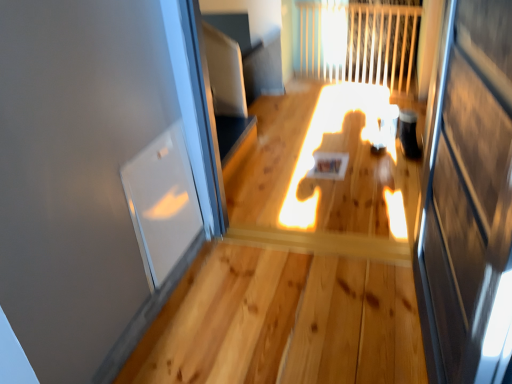
Describe the element at coordinates (468, 199) in the screenshot. I see `transparent glass screen door at right` at that location.

Locate an element on the screen. The image size is (512, 384). transparent glass screen door at right is located at coordinates (468, 199).

What do you see at coordinates (162, 203) in the screenshot? The image size is (512, 384). I see `transparent glass window at left` at bounding box center [162, 203].

You are a GUI agent. You are given a task and a screenshot of the screen. Output one action in this format:
    pyautogui.click(x=<x>, y=<y>)
    Task: Click on the transparent glass window at left
    
    Given the screenshot: What is the action you would take?
    pyautogui.click(x=162, y=203)

At what (x,y) coordinates should I click in order to perform the action: click on transparent glass screen door at right. Please return your answer as a coordinate pair (x, y). Looking at the image, I should click on (468, 199).

Considering the relative positions of transparent glass window at left and transparent glass screen door at right in the image provided, is transparent glass window at left to the right of transparent glass screen door at right from the viewer's perspective?

No, transparent glass window at left is not to the right of transparent glass screen door at right.

Which object is further away from the camera, transparent glass window at left or transparent glass screen door at right?

transparent glass window at left is more distant.

Which point is more distant from viewer, (187, 230) or (475, 294)?

The point (187, 230) is more distant.

From the image's perspective, between transparent glass window at left and transparent glass screen door at right, who is located below?

transparent glass screen door at right, from the image's perspective.

From a real-world perspective, which object rests below the other?

transparent glass window at left is physically lower.

Which object is thinner, transparent glass window at left or transparent glass screen door at right?

With smaller width is transparent glass window at left.

Based on the photo, between transparent glass window at left and transparent glass screen door at right, which one has more height?

transparent glass screen door at right.

Considering the relative sizes of transparent glass window at left and transparent glass screen door at right in the image provided, is transparent glass window at left bigger than transparent glass screen door at right?

No.

Is transparent glass screen door at right completely or partially inside transparent glass window at left?

No, transparent glass screen door at right is located outside of transparent glass window at left.

Is transparent glass window at left far from transparent glass screen door at right?

No, transparent glass window at left is in close proximity to transparent glass screen door at right.

Is transparent glass window at left facing towards transparent glass screen door at right?

Yes.

How different are the orientations of transparent glass window at left and transparent glass screen door at right in degrees?

The angular difference between transparent glass window at left and transparent glass screen door at right is 178 degrees.

Identify the location of screen door that is above the transparent glass window at left (from a real-world perspective). (468, 199).

Considering the positions of objects transparent glass screen door at right and transparent glass window at left in the image provided, who is more to the right, transparent glass screen door at right or transparent glass window at left?

transparent glass screen door at right.

Is transparent glass screen door at right closer to camera compared to transparent glass window at left?

Yes, the depth of transparent glass screen door at right is less than that of transparent glass window at left.

Does point (440, 239) lie in front of point (159, 139)?

Yes.

From the image's perspective, is transparent glass screen door at right located above or below transparent glass window at left?

Based on their image positions, transparent glass screen door at right is located beneath transparent glass window at left.

From a real-world perspective, is transparent glass screen door at right on transparent glass window at left?

Yes.

Based on the photo, can you confirm if transparent glass screen door at right is wider than transparent glass window at left?

Yes.

Who is shorter, transparent glass screen door at right or transparent glass window at left?

With less height is transparent glass window at left.

Can you confirm if transparent glass screen door at right is smaller than transparent glass window at left?

Incorrect, transparent glass screen door at right is not smaller in size than transparent glass window at left.

Does transparent glass screen door at right contain transparent glass window at left?

No.

Is transparent glass screen door at right not close to transparent glass window at left?

They are positioned close to each other.

Is transparent glass screen door at right facing away from transparent glass window at left?

transparent glass screen door at right does not have its back to transparent glass window at left.

Can you tell me how much transparent glass screen door at right and transparent glass window at left differ in facing direction?

They differ by 178 degrees in their facing directions.

Where is `screen door located on the right of transparent glass window at left`? Image resolution: width=512 pixels, height=384 pixels. screen door located on the right of transparent glass window at left is located at coordinates (468, 199).

The image size is (512, 384). In order to click on screen door in front of the transparent glass window at left in this screenshot , I will do `click(468, 199)`.

In the image, there is a transparent glass screen door at right. Identify the location of window below it (from a real-world perspective). 162,203.